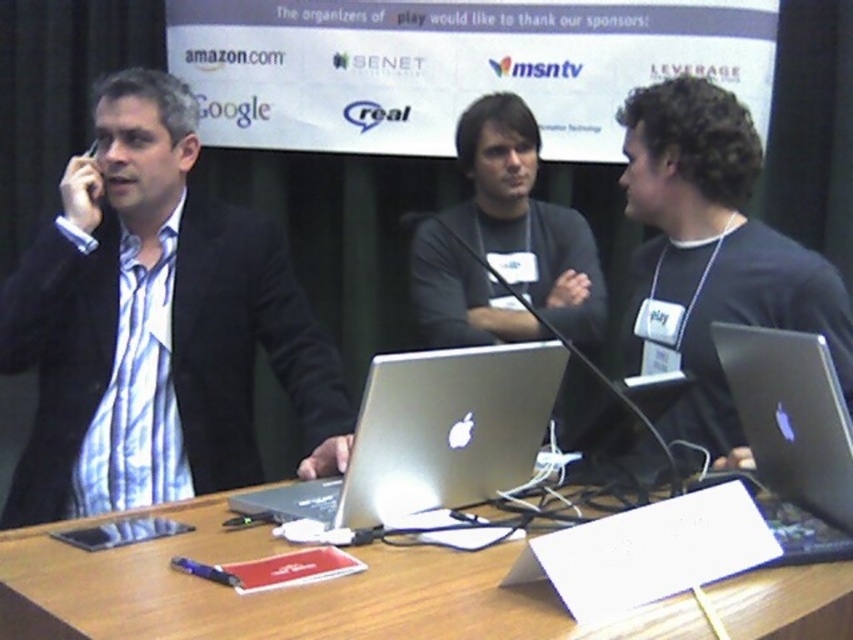
You are a security guard in a building and you see the point at coordinates (155,326). What object is this point located on?

The point at coordinates (155,326) is located on the matte black suit at left.

You are a photographer at the conference. You need to take a photo of the matte black suit at left and the satin silver laptop at right. Considering their heights, which object will appear larger in the photo?

The matte black suit at left is much taller than the satin silver laptop at right, so it will appear larger in the photo.